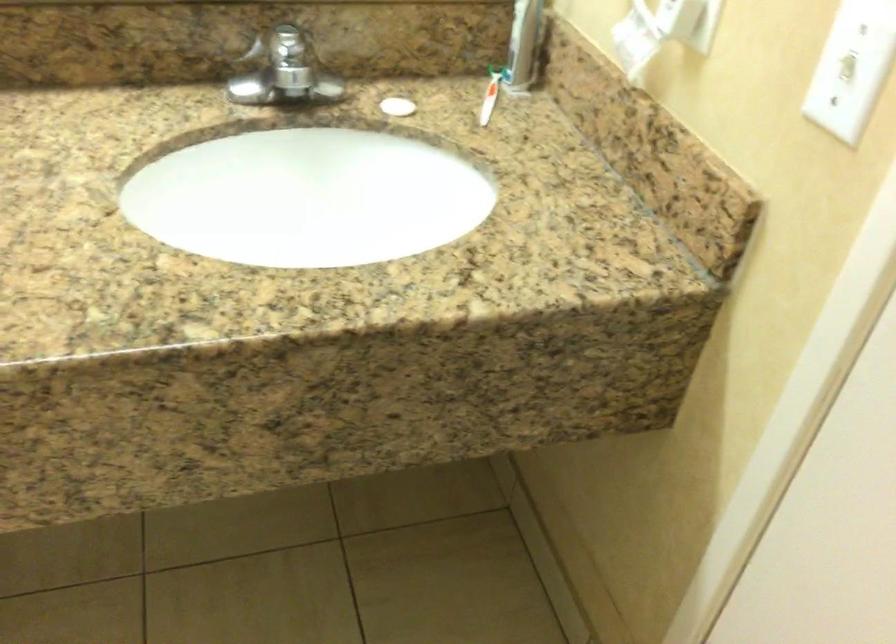
Identify the location of white light switch. (851, 68).